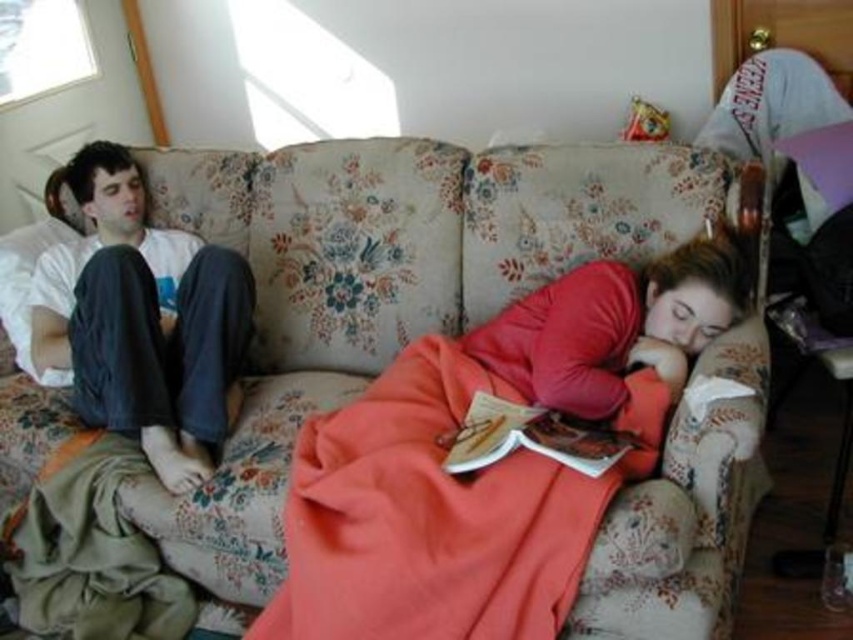
Question: Does floral fabric couch at center have a lesser width compared to hardcover book at center?

Choices:
 (A) no
 (B) yes

Answer: (A)

Question: Does floral fabric couch at center have a greater width compared to coral fleece blanket at lower center?

Choices:
 (A) no
 (B) yes

Answer: (B)

Question: Is white cotton shirt at upper left thinner than hardcover book at center?

Choices:
 (A) yes
 (B) no

Answer: (B)

Question: Which point is closer to the camera?

Choices:
 (A) (358, 444)
 (B) (556, 449)

Answer: (B)

Question: Which object is closer to the camera taking this photo?

Choices:
 (A) coral fleece blanket at lower center
 (B) white cotton shirt at upper left
 (C) hardcover book at center
 (D) floral fabric couch at center

Answer: (A)

Question: Which point is farther to the camera?

Choices:
 (A) white cotton shirt at upper left
 (B) floral fabric couch at center
 (C) coral fleece blanket at lower center
 (D) hardcover book at center

Answer: (A)